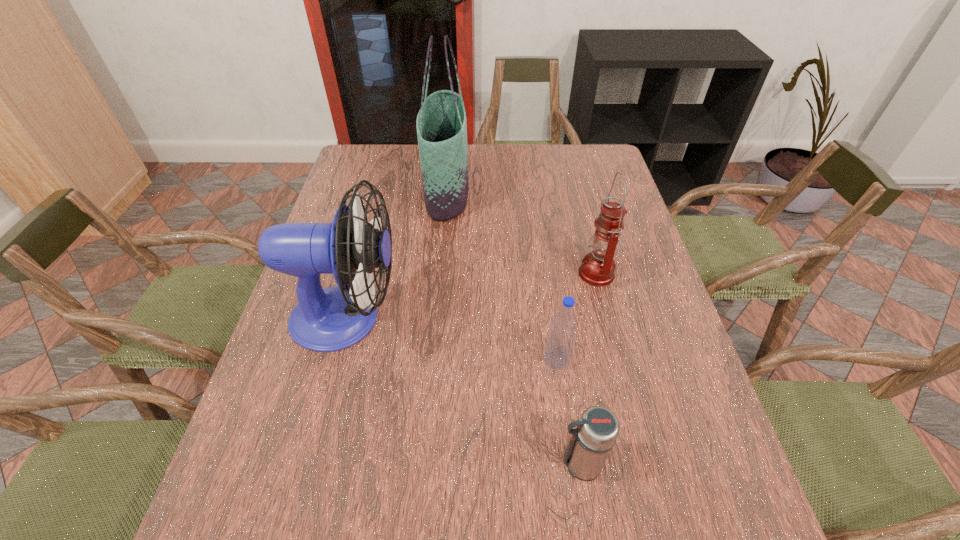
Identify the location of vacant space at the left edge of the desktop. Image resolution: width=960 pixels, height=540 pixels. (311, 471).

The image size is (960, 540). I want to click on free point at the right edge, so click(585, 205).

Locate an element on the screen. vacant area that lies between the leftmost object and the third tallest object is located at coordinates [x=471, y=295].

The width and height of the screenshot is (960, 540). Find the location of `vacant area between the fourth object from right to left and the thermos bottle`. vacant area between the fourth object from right to left and the thermos bottle is located at coordinates (x=513, y=327).

Image resolution: width=960 pixels, height=540 pixels. What are the coordinates of `blank region between the leftmost object and the third shortest object` in the screenshot? It's located at (471, 295).

Identify the location of unoccupied area between the water bottle and the nearest object. (568, 411).

I want to click on free spot between the fan and the thermos bottle, so click(463, 390).

Where is `vacant region between the fourth object from right to left and the water bottle`? vacant region between the fourth object from right to left and the water bottle is located at coordinates (501, 275).

Locate an element on the screen. empty space that is in between the rightmost object and the fan is located at coordinates (471, 295).

Where is `vacant space that is in between the third shortest object and the water bottle`? The width and height of the screenshot is (960, 540). vacant space that is in between the third shortest object and the water bottle is located at coordinates (576, 316).